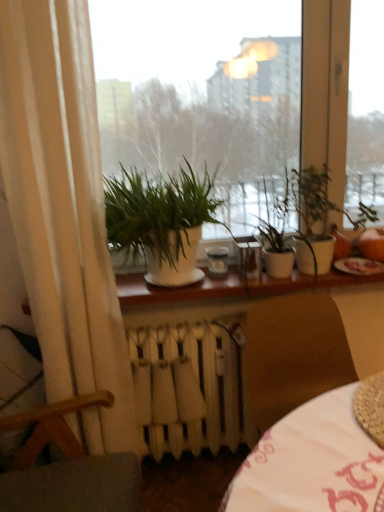
Question: Is white glossy window at center not near wooden armchair at lower left?

Choices:
 (A) yes
 (B) no

Answer: (A)

Question: Is white glossy window at center looking in the opposite direction of wooden armchair at lower left?

Choices:
 (A) no
 (B) yes

Answer: (A)

Question: Does white glossy window at center have a greater width compared to wooden armchair at lower left?

Choices:
 (A) no
 (B) yes

Answer: (A)

Question: Is white glossy window at center at the left side of wooden armchair at lower left?

Choices:
 (A) yes
 (B) no

Answer: (B)

Question: Does white glossy window at center have a greater height compared to wooden armchair at lower left?

Choices:
 (A) no
 (B) yes

Answer: (B)

Question: Is point (382, 273) positioned closer to the camera than point (317, 221)?

Choices:
 (A) farther
 (B) closer

Answer: (B)

Question: From the image's perspective, is white glossy window sill at center above or below green matte plant at center, which is the first houseplant from right to left?

Choices:
 (A) above
 (B) below

Answer: (B)

Question: Considering the relative positions of white glossy window sill at center and green matte plant at center, which is the first houseplant from right to left, in the image provided, is white glossy window sill at center to the left or to the right of green matte plant at center, which is the first houseplant from right to left,?

Choices:
 (A) right
 (B) left

Answer: (B)

Question: Looking at the image, does white glossy window sill at center seem bigger or smaller compared to green matte plant at center, which is the first houseplant from right to left?

Choices:
 (A) big
 (B) small

Answer: (B)

Question: Is point (273, 240) positioned closer to the camera than point (342, 114)?

Choices:
 (A) closer
 (B) farther

Answer: (A)

Question: From the image's perspective, is green matte plant at center, which is the first houseplant from right to left, located above or below white glossy window at center?

Choices:
 (A) below
 (B) above

Answer: (A)

Question: Considering their positions, is green matte plant at center, which is the first houseplant from right to left, located in front of or behind white glossy window at center?

Choices:
 (A) front
 (B) behind

Answer: (A)

Question: From their relative heights in the image, would you say green matte plant at center, which ranks as the 2th houseplant in left-to-right order, is taller or shorter than white glossy window at center?

Choices:
 (A) short
 (B) tall

Answer: (A)

Question: Considering the positions of white fabric curtain at left and white fabric table at lower right in the image, is white fabric curtain at left wider or thinner than white fabric table at lower right?

Choices:
 (A) wide
 (B) thin

Answer: (B)

Question: From a real-world perspective, is white fabric curtain at left positioned above or below white fabric table at lower right?

Choices:
 (A) below
 (B) above

Answer: (B)